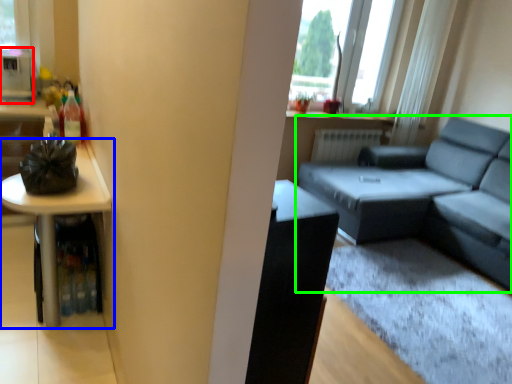
Question: Based on their relative distances, which object is nearer to appliance (highlighted by a red box)? Choose from table (highlighted by a blue box) and studio couch (highlighted by a green box).

Choices:
 (A) table
 (B) studio couch

Answer: (A)